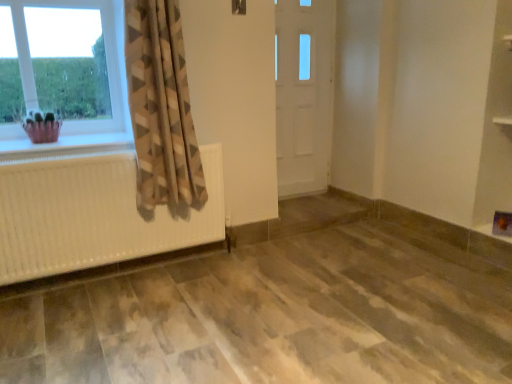
Question: Based on their sizes in the image, would you say beige textured curtain at left is bigger or smaller than white textured radiator at left?

Choices:
 (A) big
 (B) small

Answer: (A)

Question: Is point (180, 72) positioned closer to the camera than point (104, 139)?

Choices:
 (A) farther
 (B) closer

Answer: (B)

Question: Based on their relative distances, which object is nearer to the white wooden door at center?

Choices:
 (A) pink fabric basket at left
 (B) white textured radiator at left
 (C) clear glass window at upper left
 (D) beige textured curtain at left
 (E) white textured radiator at left

Answer: (D)

Question: Estimate the real-world distances between objects in this image. Which object is farther from the white textured radiator at left?

Choices:
 (A) beige textured curtain at left
 (B) clear glass window at upper left
 (C) white textured radiator at left
 (D) pink fabric basket at left
 (E) white wooden door at center

Answer: (E)